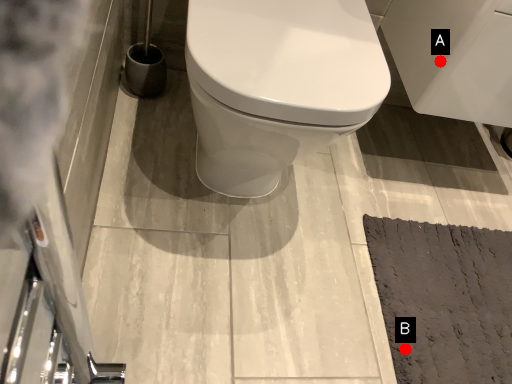
Question: Two points are circled on the image, labeled by A and B beside each circle. Which of the following is the farthest from the observer?

Choices:
 (A) A is further
 (B) B is further

Answer: (B)